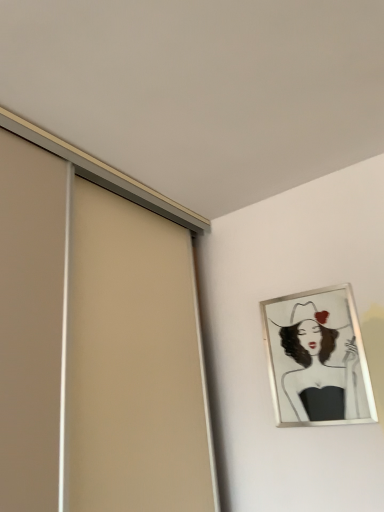
The width and height of the screenshot is (384, 512). What do you see at coordinates (317, 359) in the screenshot?
I see `silver metallic picture frame at upper right` at bounding box center [317, 359].

Locate an element on the screen. Image resolution: width=384 pixels, height=512 pixels. silver metallic picture frame at upper right is located at coordinates (317, 359).

Find the location of a particular element. The height and width of the screenshot is (512, 384). silver metallic picture frame at upper right is located at coordinates (317, 359).